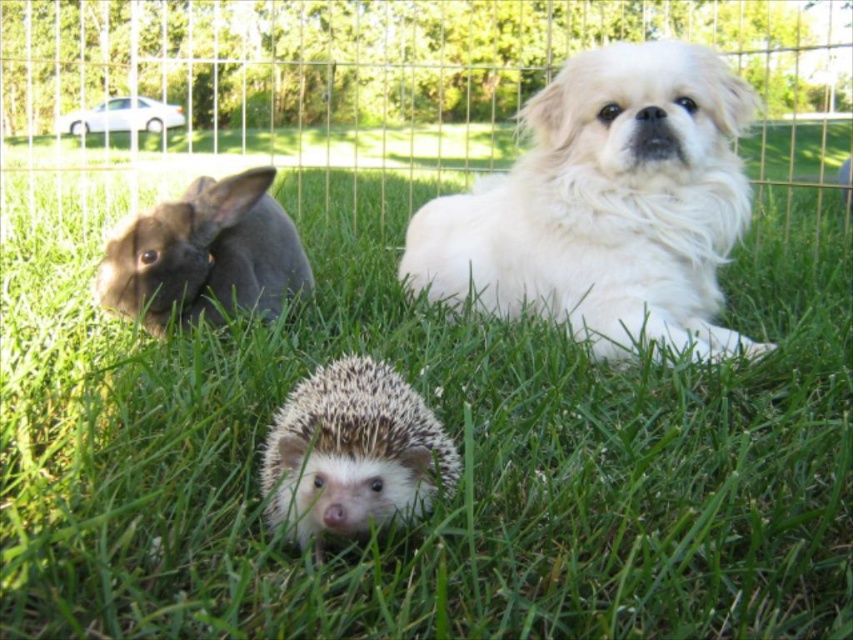
You are standing at the origin point of the coordinate system in this image. You want to walk towards the point at coordinates point(361, 81). However, there is an obstacle at point(285, 246). Based on their positions, will you encounter the obstacle before reaching your destination?

Yes, because point(361, 81) is behind point(285, 246), so the obstacle at point(285, 246) will be encountered first.

You are a gardener trying to determine the best path to walk through the garden without getting too close to the metallic wire fence at upper center and the dark gray fur rabbit at left. Which object is wider, making you need to give it more space?

The metallic wire fence at upper center is wider than the dark gray fur rabbit at left, so you should give more space to the metallic wire fence at upper center.

You are a photographer standing in front of the scene. You want to take a photo of the white fluffy dog at center and the white spiny hedgehog at center. Which animal should you focus on first to ensure both are in focus?

You should focus on the white spiny hedgehog at center first because it is closer to you than the white fluffy dog at center, which is further away. By focusing on the closer object, both will be in focus if they are within the depth of field.